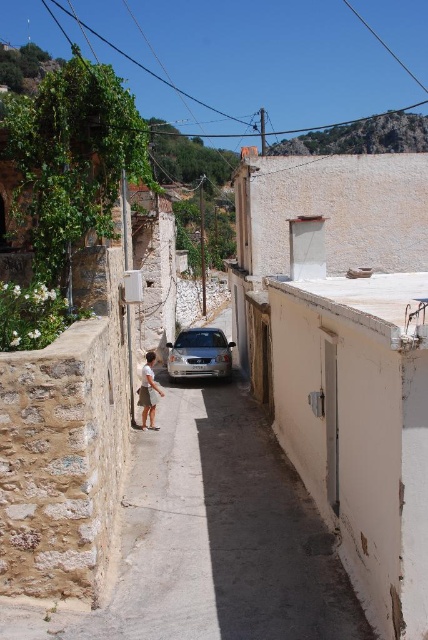
You are standing in the narrow alleyway and want to walk towards the end of the alley. There are two points marked in the image. Which point, point (157, 620) or point (154, 417), is closer to you as you face the alley?

Point (157, 620) is closer to the viewer than point (154, 417).

Consider the image. You are standing at the entrance of the narrow, sunlit alleyway in a Mediterranean village. You need to walk to the smooth concrete alley at center. According to the coordinates provided, in which direction should you move relative to your current position?

The smooth concrete alley at center is located at point 0.841 on the x and 0.523 on the y. Since you are at the entrance, you should move forward towards the center of the alley to reach it.

You are a delivery person with a 1.2 meter wide cart. You need to navigate through the smooth concrete alley at center while avoiding the white cotton shirt at center. Can your cart pass through the alley without touching the shirt?

The smooth concrete alley at center is wider than the white cotton shirt at center, so yes, the cart can pass through the alley without touching the shirt as long as it stays centered.